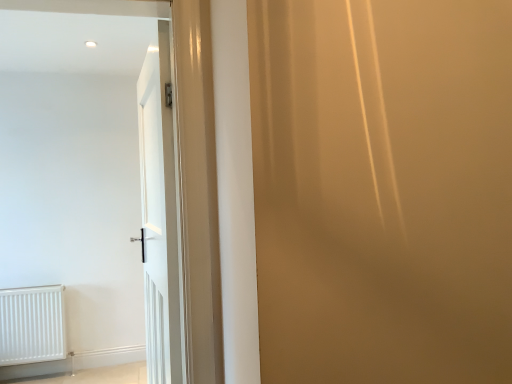
Question: Is white glossy door at center far away from white matte radiator at lower left?

Choices:
 (A) yes
 (B) no

Answer: (A)

Question: From a real-world perspective, is white glossy door at center physically below white matte radiator at lower left?

Choices:
 (A) no
 (B) yes

Answer: (A)

Question: Considering the relative sizes of white glossy door at center and white matte radiator at lower left in the image provided, is white glossy door at center smaller than white matte radiator at lower left?

Choices:
 (A) no
 (B) yes

Answer: (A)

Question: Is the position of white glossy door at center less distant than that of white matte radiator at lower left?

Choices:
 (A) no
 (B) yes

Answer: (B)

Question: Is white glossy door at center behind white matte radiator at lower left?

Choices:
 (A) yes
 (B) no

Answer: (B)

Question: Does white glossy door at center appear on the right side of white matte radiator at lower left?

Choices:
 (A) yes
 (B) no

Answer: (A)

Question: Is white glossy door at center surrounded by white matte radiator at lower left?

Choices:
 (A) yes
 (B) no

Answer: (B)

Question: Can you confirm if white matte radiator at lower left is bigger than white glossy door at center?

Choices:
 (A) no
 (B) yes

Answer: (A)

Question: Is white matte radiator at lower left positioned before white glossy door at center?

Choices:
 (A) yes
 (B) no

Answer: (B)

Question: From the image's perspective, does white matte radiator at lower left appear lower than white glossy door at center?

Choices:
 (A) no
 (B) yes

Answer: (B)

Question: Is white matte radiator at lower left turned away from white glossy door at center?

Choices:
 (A) no
 (B) yes

Answer: (A)

Question: Is white matte radiator at lower left behind white glossy door at center?

Choices:
 (A) no
 (B) yes

Answer: (B)

Question: In terms of width, does white matte radiator at lower left look wider or thinner when compared to white glossy door at center?

Choices:
 (A) thin
 (B) wide

Answer: (B)